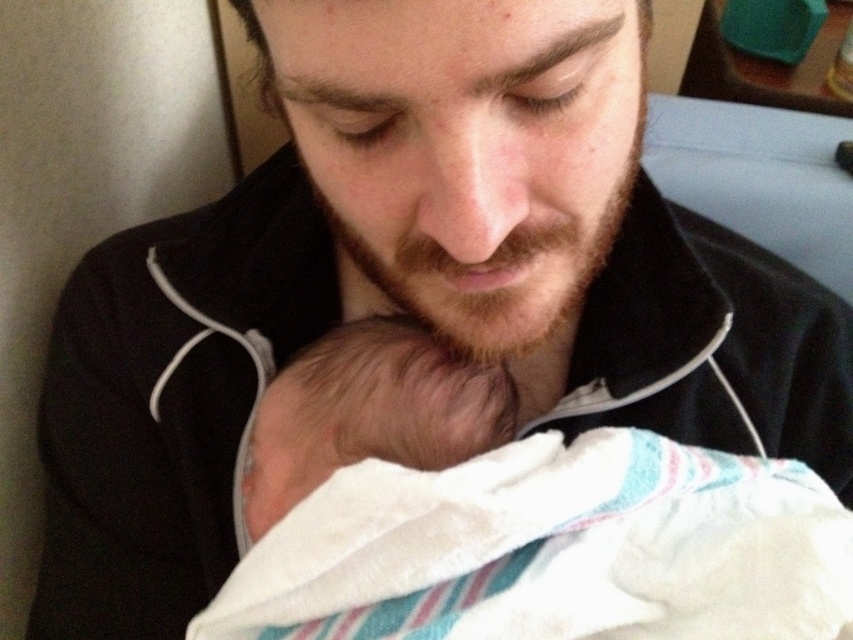
Does soft white blanket at lower center appear on the right side of soft beige skin at center?

Indeed, soft white blanket at lower center is positioned on the right side of soft beige skin at center.

Who is more forward, (316,364) or (294,481)?

Point (294,481)

Between point (292, 360) and point (334, 394), which one is positioned in front?

Point (334, 394)

Locate an element on the screen. The image size is (853, 640). soft white blanket at lower center is located at coordinates 508,516.